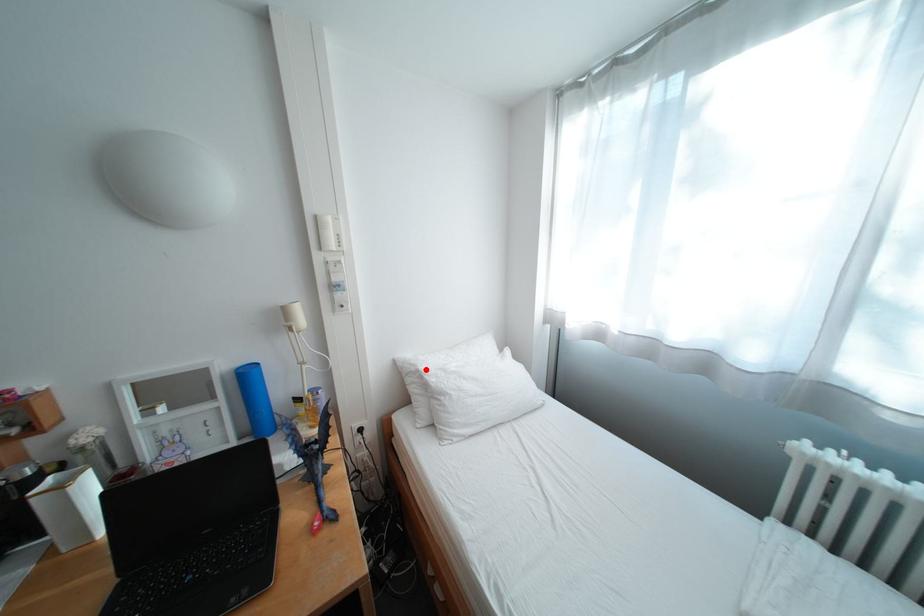
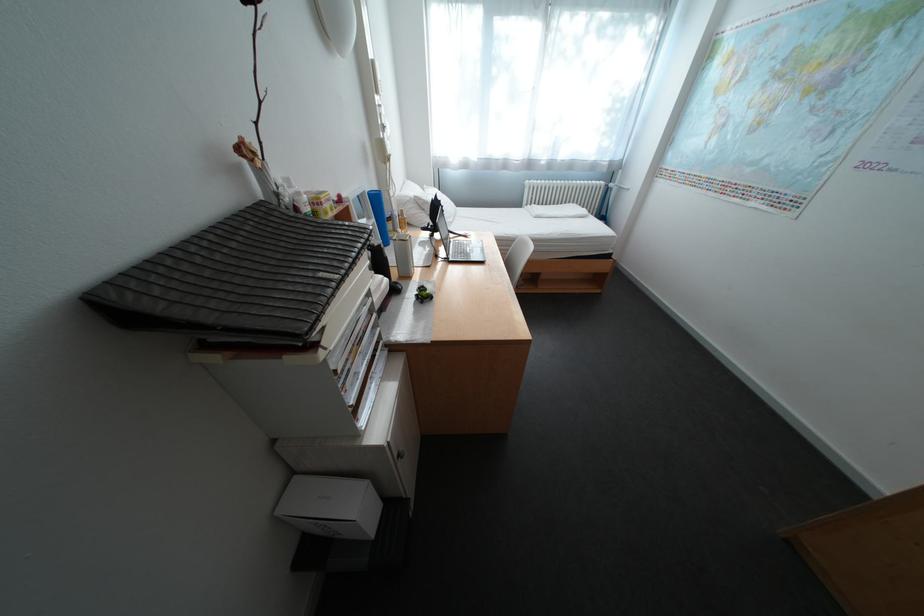
Question: I am providing you with two images of the same scene from different viewpoints. In image1, a red point is highlighted. Considering the same 3D point in image2, which of the following is correct?

Choices:
 (A) It is closer
 (B) It is farther

Answer: (A)